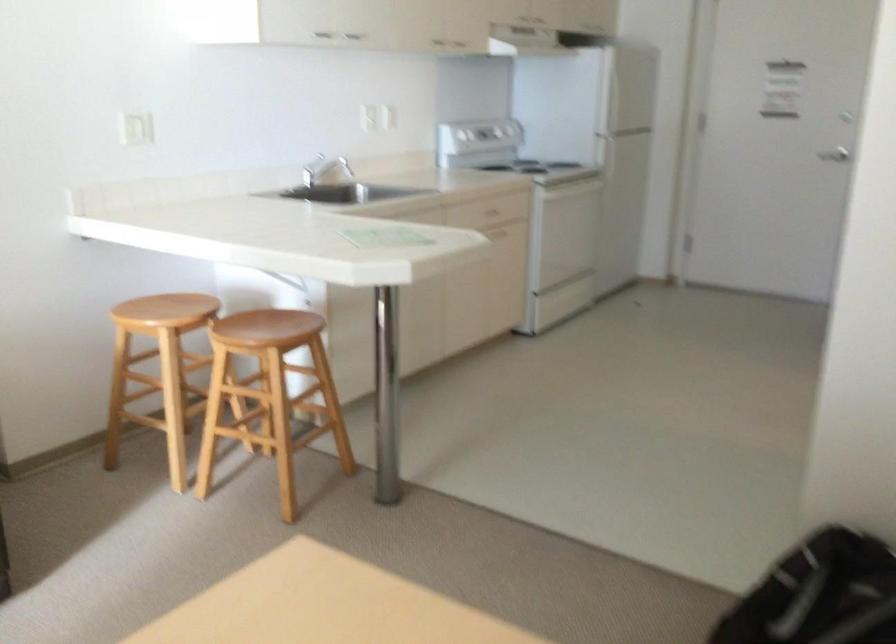
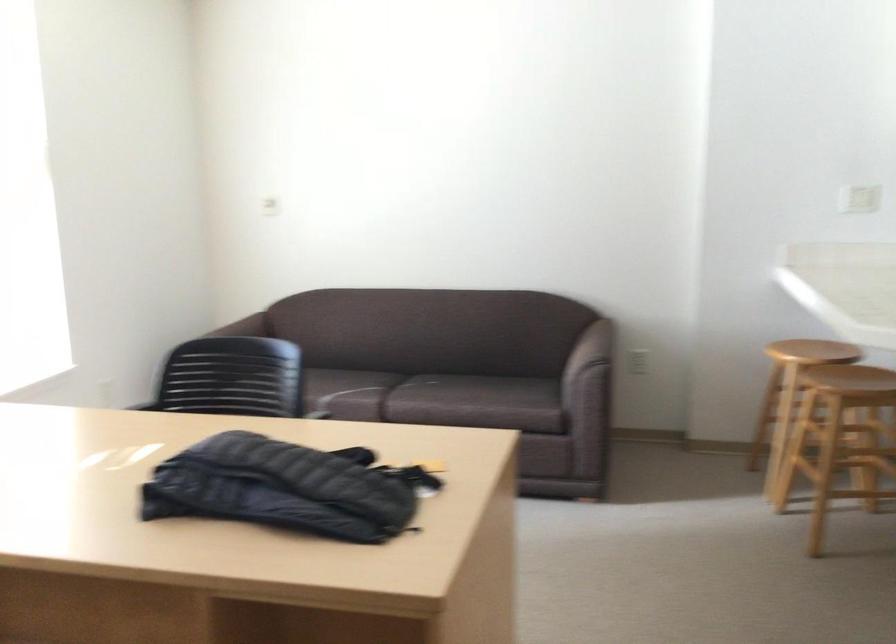
The point at (x=175, y=374) is marked in the first image. Where is the corresponding point in the second image?

(789, 395)